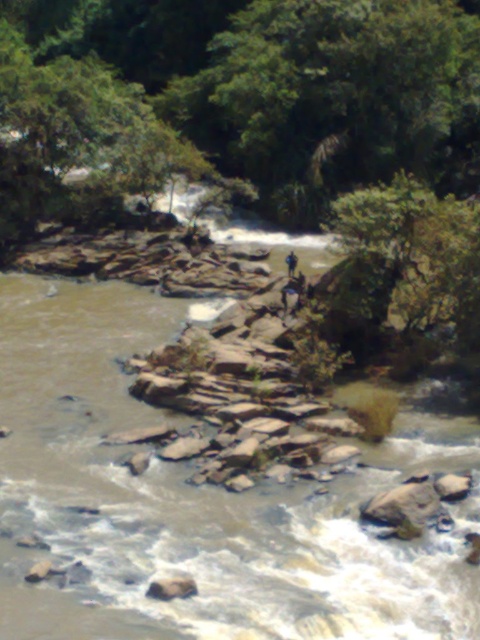
Based on the photo, can you confirm if brown rough rock at lower left is positioned below dark blue jeans at center?

Yes, brown rough rock at lower left is below dark blue jeans at center.

Measure the distance between point (159, 582) and camera.

Point (159, 582) and camera are 35.73 feet apart.

You are a GUI agent. You are given a task and a screenshot of the screen. Output one action in this format:
    pyautogui.click(x=<x>, y=<y>)
    Task: Click on the brown rough rock at lower left
    
    Given the screenshot: What is the action you would take?
    pyautogui.click(x=171, y=588)